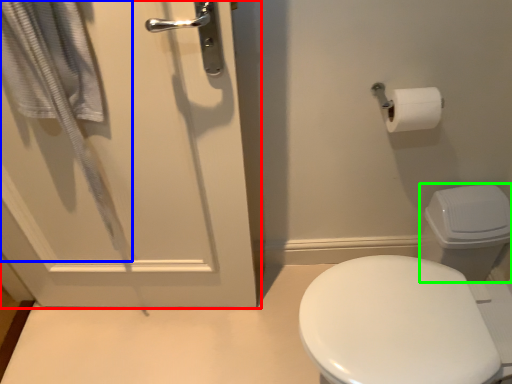
Question: Which object is the farthest from door (highlighted by a red box)? Choose among these: bath towel (highlighted by a blue box) or toilet bowl (highlighted by a green box).

Choices:
 (A) bath towel
 (B) toilet bowl

Answer: (B)